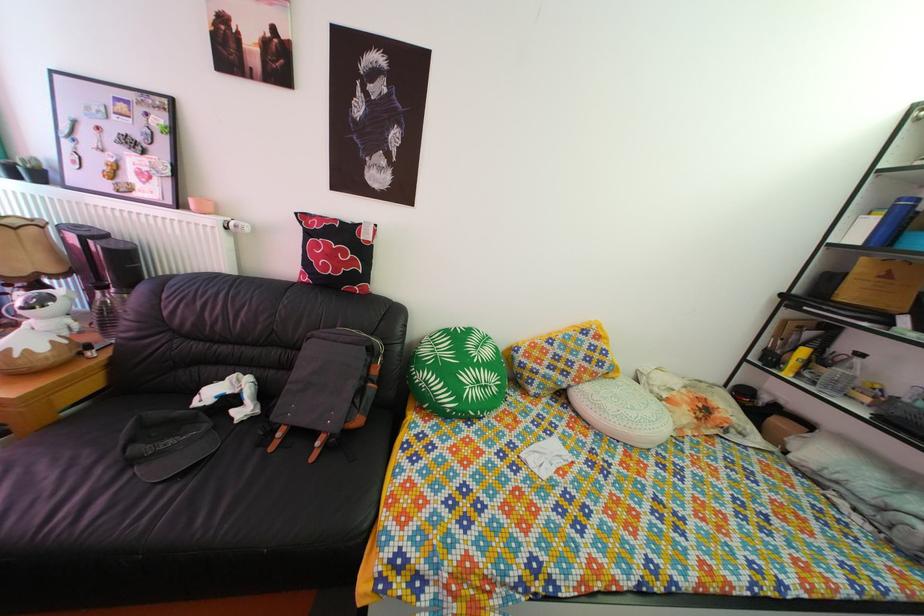
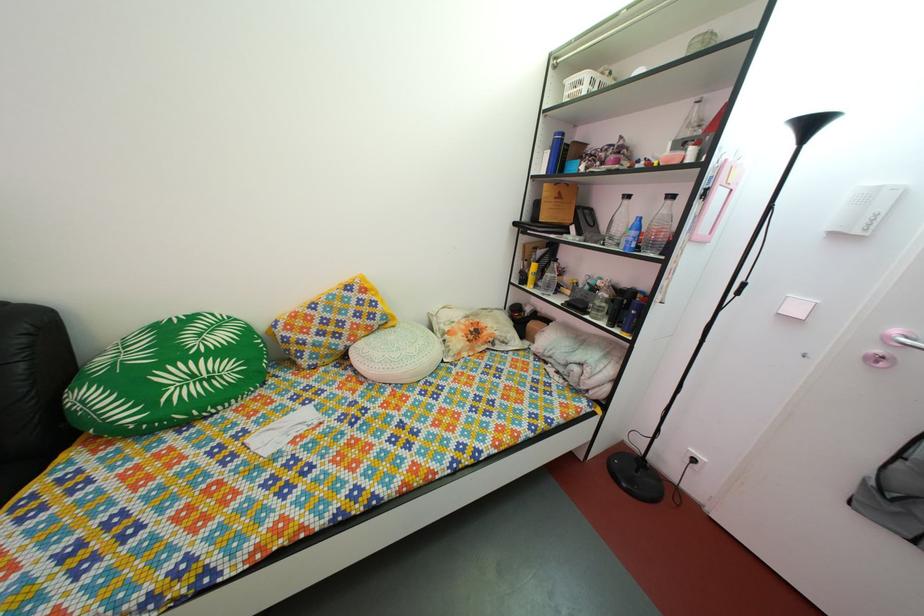
Locate, in the second image, the point that corresponds to the point at 803,373 in the first image.

(540, 286)